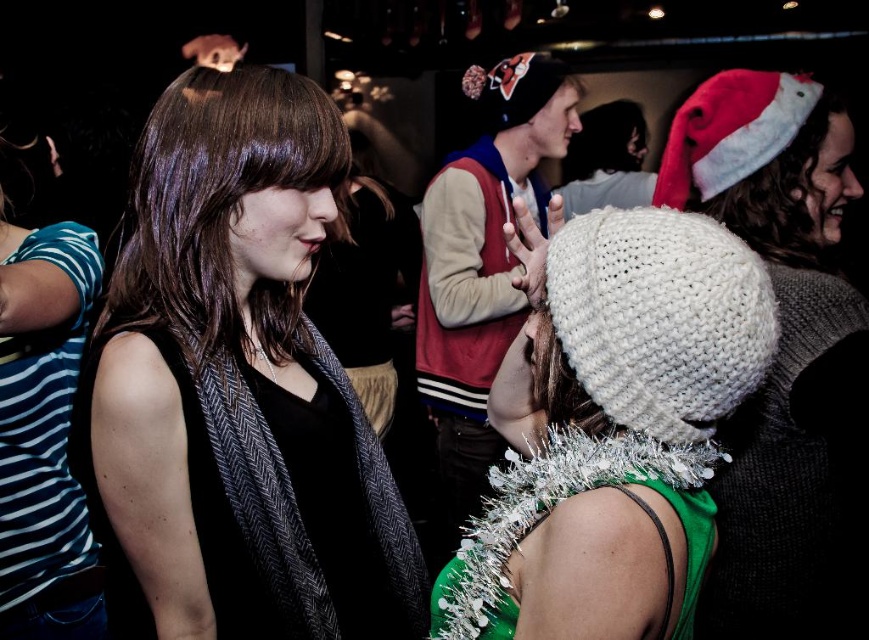
Question: Does matte black scarf at left appear under shiny brown hair at center?

Choices:
 (A) no
 (B) yes

Answer: (B)

Question: Estimate the real-world distances between objects in this image. Which object is closer to the matte black scarf at left?

Choices:
 (A) white knitted beanie at center
 (B) shiny brown hair at center

Answer: (B)

Question: Does matte black scarf at left appear on the right side of white knitted beanie at center?

Choices:
 (A) yes
 (B) no

Answer: (B)

Question: Does matte black scarf at left appear on the right side of shiny brown hair at center?

Choices:
 (A) no
 (B) yes

Answer: (B)

Question: Among these objects, which one is farthest from the camera?

Choices:
 (A) matte black scarf at left
 (B) shiny brown hair at center

Answer: (B)

Question: Which of the following is the closest to the observer?

Choices:
 (A) white knitted beanie at center
 (B) shiny brown hair at center
 (C) matte black scarf at left

Answer: (A)